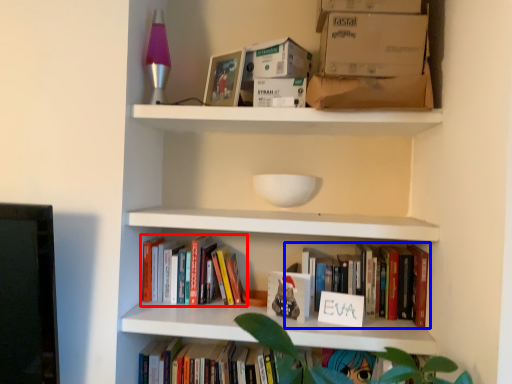
Question: Which object is closer to the camera taking this photo, book (highlighted by a red box) or book (highlighted by a blue box)?

Choices:
 (A) book
 (B) book

Answer: (B)